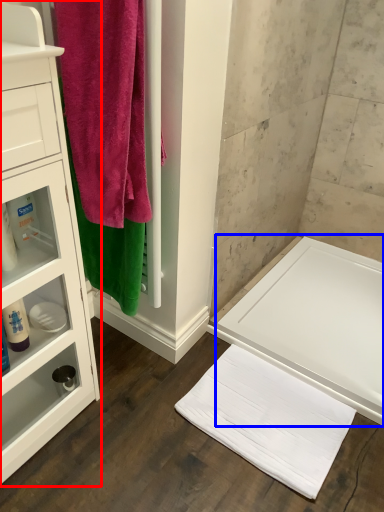
Question: Which point is closer to the camera, bathroom cabinet (highlighted by a red box) or bath (highlighted by a blue box)?

Choices:
 (A) bathroom cabinet
 (B) bath

Answer: (A)